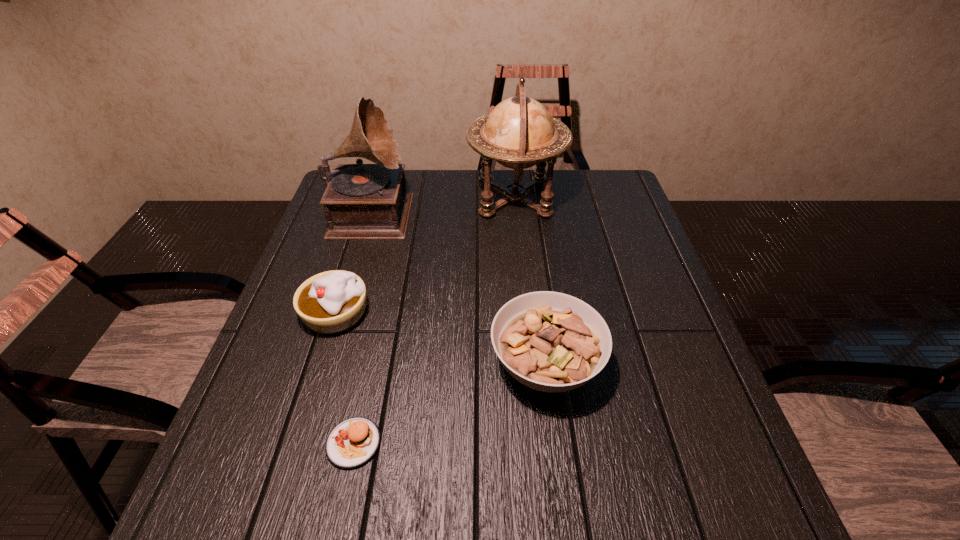
The height and width of the screenshot is (540, 960). Find the location of `vacant space at the left edge of the desktop`. vacant space at the left edge of the desktop is located at coordinates (356, 260).

Where is `vacant space at the right edge`? The width and height of the screenshot is (960, 540). vacant space at the right edge is located at coordinates (607, 218).

Identify the location of free location at the far right corner of the desktop. (571, 175).

Locate an element on the screen. This screenshot has height=540, width=960. unoccupied position between the record player and the whipped cream is located at coordinates (354, 262).

You are a GUI agent. You are given a task and a screenshot of the screen. Output one action in this format:
    pyautogui.click(x=<x>, y=<y>)
    Task: Click on the empty space between the patty and the whipped cream
    The height and width of the screenshot is (540, 960).
    Given the screenshot: What is the action you would take?
    pyautogui.click(x=345, y=378)

Locate an element on the screen. blank region between the stew and the record player is located at coordinates (459, 288).

Identify the location of vacant space that is in between the record player and the stew. (459, 288).

At what (x,y) coordinates should I click in order to perform the action: click on vacant area between the stew and the record player. Please return your answer as a coordinate pair (x, y). Looking at the image, I should click on (459, 288).

Where is `free area in between the whipped cream and the stew`? The height and width of the screenshot is (540, 960). free area in between the whipped cream and the stew is located at coordinates (441, 339).

Where is `vacant area that lies between the globe and the record player`? This screenshot has height=540, width=960. vacant area that lies between the globe and the record player is located at coordinates (444, 205).